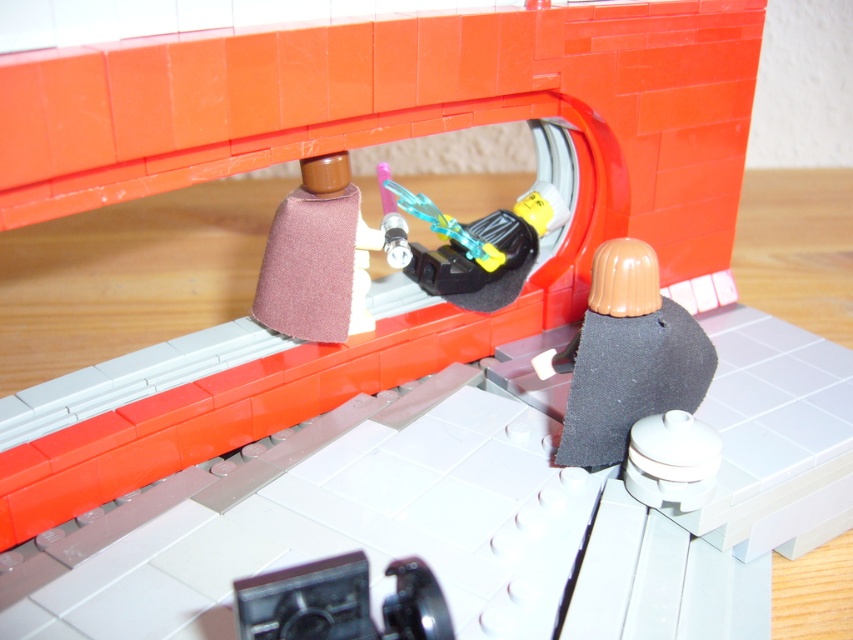
You are a LEGO minifigure trying to reach the brown fabric cone at center from the dark gray fabric at lower right. Which direction should you move?

The dark gray fabric at lower right is to the right of the brown fabric cone at center. So to reach the brown fabric cone at center, you should move to the left.

You are a LEGO figure trying to reach the brown fabric cone at center from the dark gray fabric at lower right. Can you move directly forward without any obstacles?

The dark gray fabric at lower right is in front of the brown fabric cone at center, so moving forward from the dark gray fabric at lower right would block your path to the brown fabric cone at center. You need to move sideways or backward to avoid the obstacle.